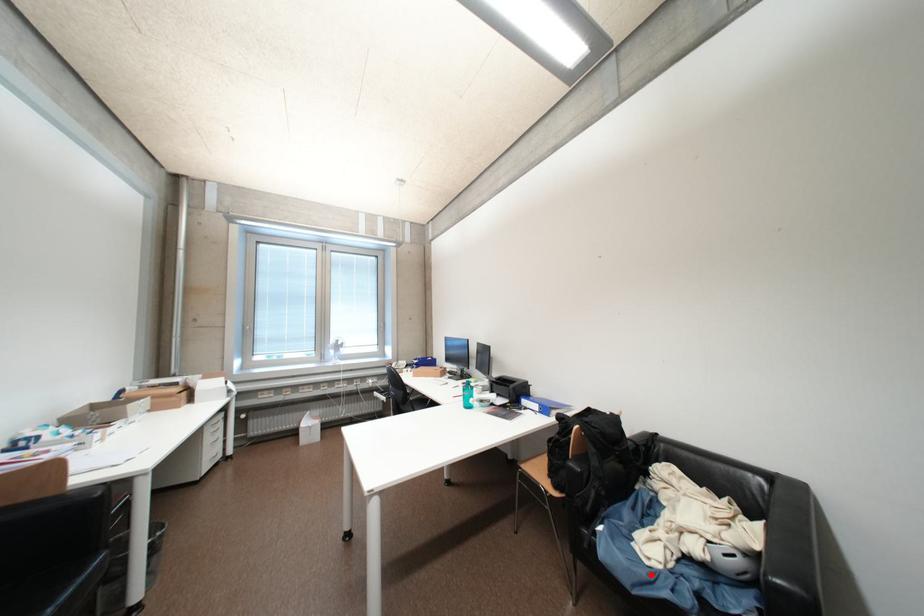
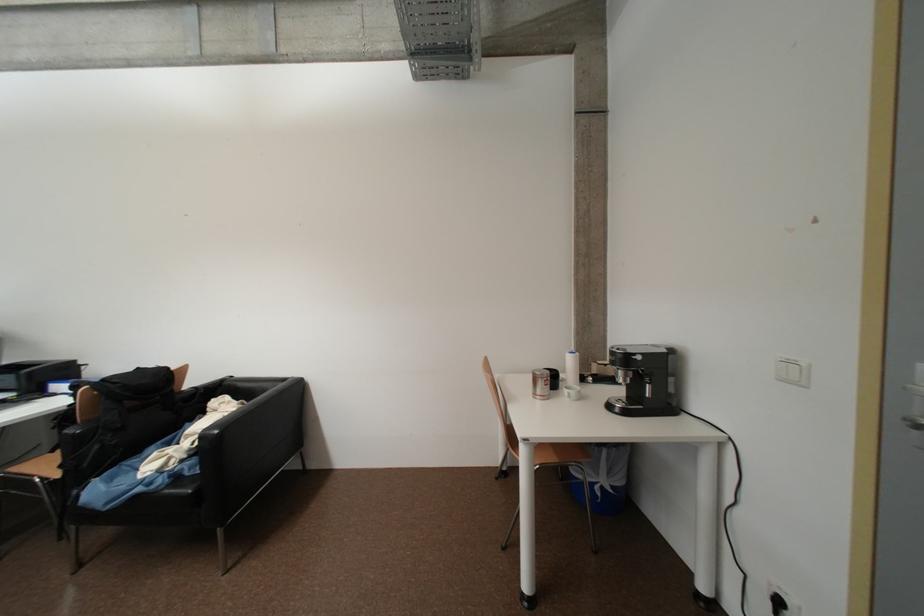
Locate, in the second image, the point that corresponds to the highlighted location in the first image.

(130, 488)